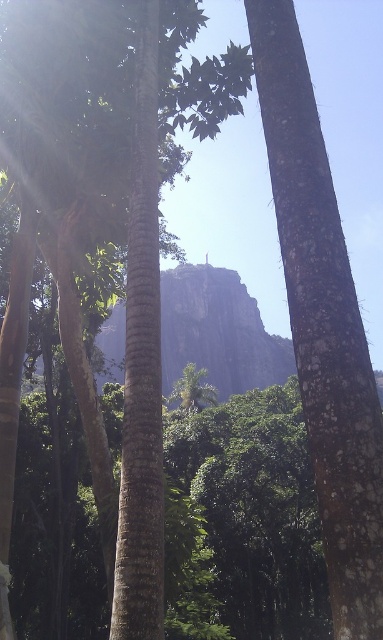
Question: Is rugged stone mountain at center to the left of green leafy palm tree at center from the viewer's perspective?

Choices:
 (A) no
 (B) yes

Answer: (B)

Question: Can you confirm if rugged stone mountain at center is positioned to the left of green leafy palm tree at center?

Choices:
 (A) yes
 (B) no

Answer: (A)

Question: Which point is farther from the camera taking this photo?

Choices:
 (A) (250, 304)
 (B) (181, 378)

Answer: (A)

Question: In this image, where is rugged stone mountain at center located relative to green leafy palm tree at center?

Choices:
 (A) left
 (B) right

Answer: (A)